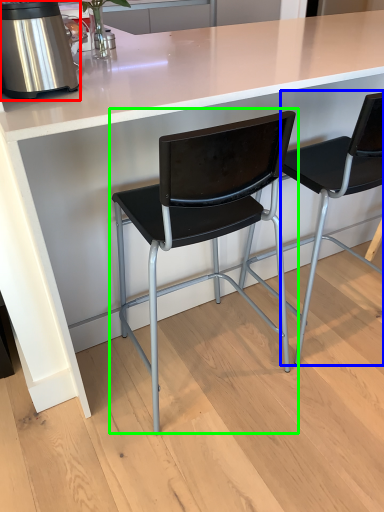
Question: Based on their relative distances, which object is farther from kitchen appliance (highlighted by a red box)? Choose from chair (highlighted by a blue box) and chair (highlighted by a green box).

Choices:
 (A) chair
 (B) chair

Answer: (A)